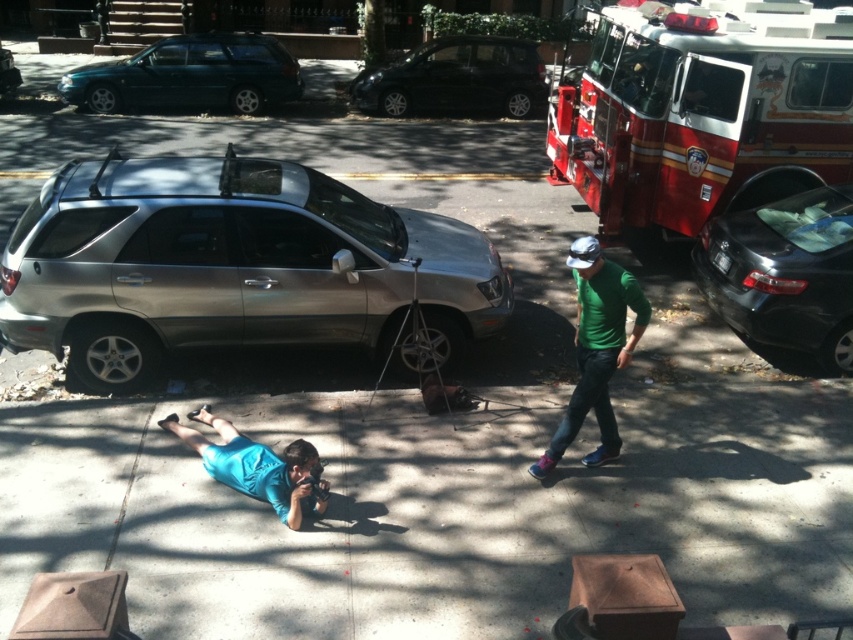
You are a delivery driver who needs to park your teal matte station wagon at upper left in a specific spot. The parking spot is located at coordinates 0.12, 0.22. Is your vehicle already positioned correctly?

The teal matte station wagon at upper left is located at point [189,76], which is very close to the desired coordinates [187,76]. Considering minor rounding differences, the vehicle is positioned correctly.